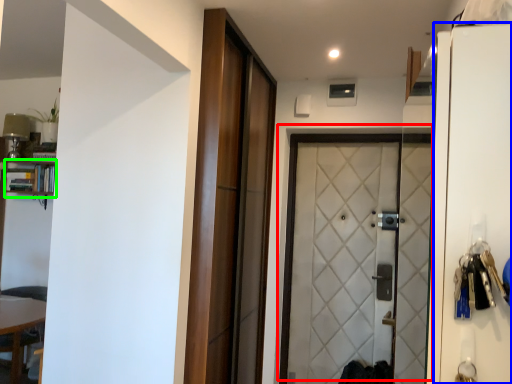
Question: Considering the real-world distances, which object is farthest from door (highlighted by a red box)? screen door (highlighted by a blue box) or bookshelf (highlighted by a green box)?

Choices:
 (A) screen door
 (B) bookshelf

Answer: (A)